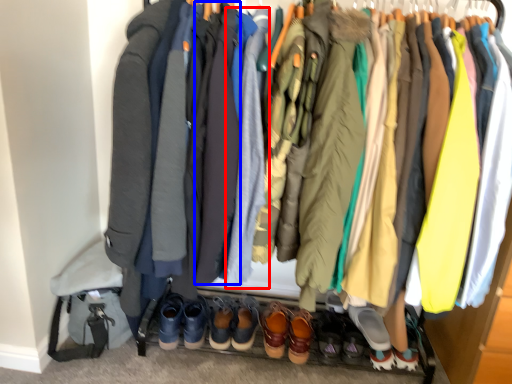
Question: Which object appears farthest to the camera in this image, robe (highlighted by a red box) or robe (highlighted by a blue box)?

Choices:
 (A) robe
 (B) robe

Answer: (B)